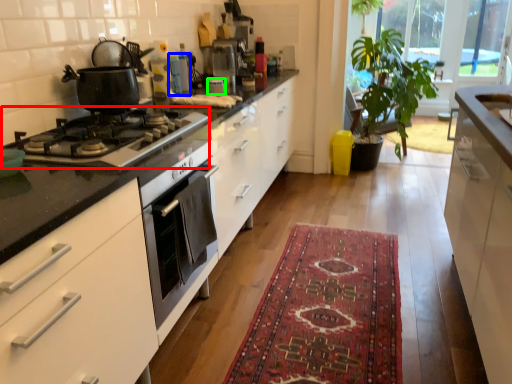
Question: Based on their relative distances, which object is farther from gas stove (highlighted by a red box)? Choose from appliance (highlighted by a blue box) and appliance (highlighted by a green box).

Choices:
 (A) appliance
 (B) appliance

Answer: (B)